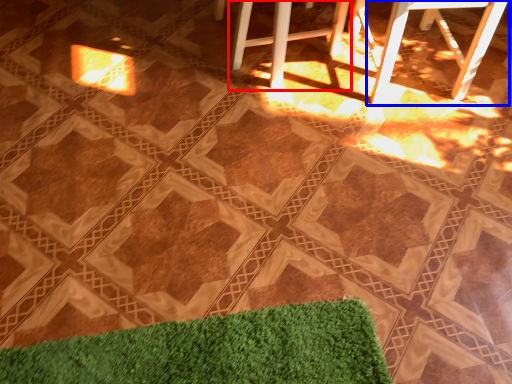
Question: Which object is closer to the camera taking this photo, bar stool (highlighted by a red box) or bar stool (highlighted by a blue box)?

Choices:
 (A) bar stool
 (B) bar stool

Answer: (B)